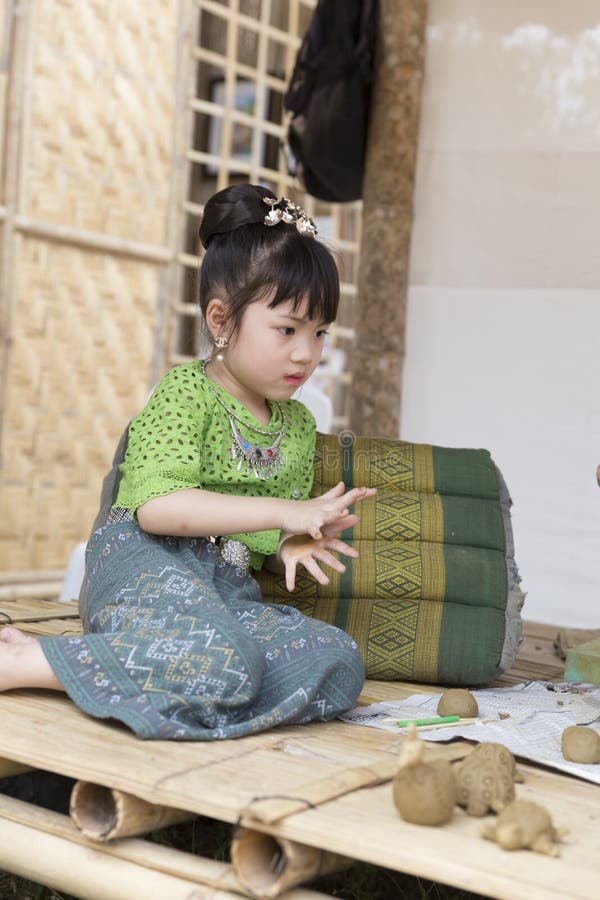
You are a GUI agent. You are given a task and a screenshot of the screen. Output one action in this format:
    pyautogui.click(x=<x>, y=<y>)
    Task: Click on the windows
    The image size is (600, 900).
    Given the screenshot: What is the action you would take?
    pyautogui.click(x=180, y=331)